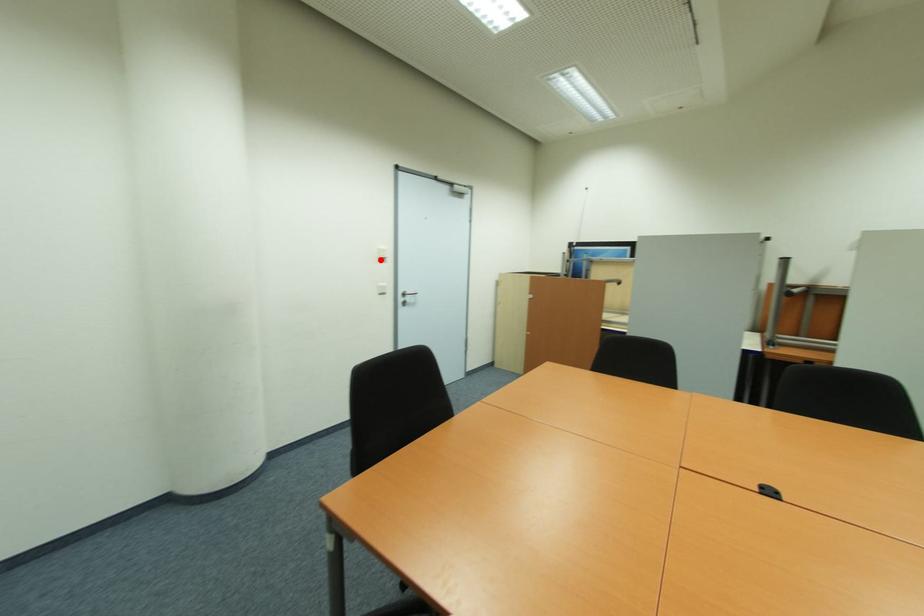
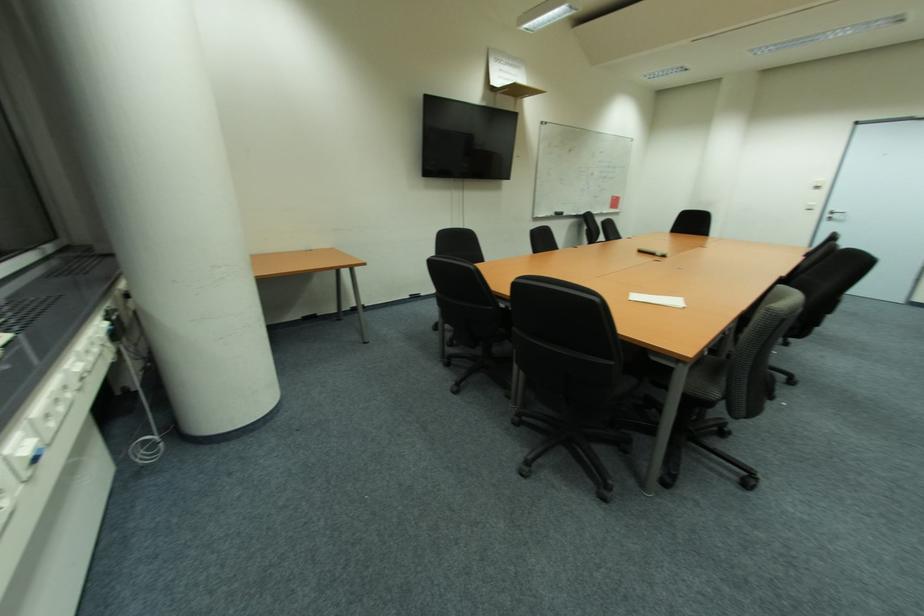
Question: I am providing you with two images of the same scene from different viewpoints. Image1 has a red point marked. In image2, the corresponding 3D location appears at what relative position? Reply with the corresponding letter.

Choices:
 (A) Closer
 (B) Farther

Answer: (B)